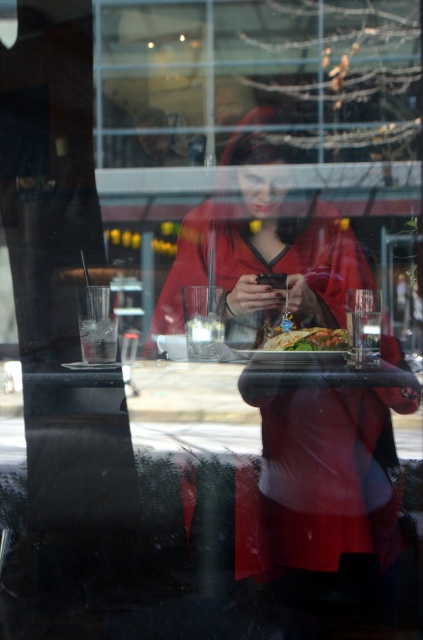
You are a delivery person standing outside the window. You want to hand over a package to the person wearing the matte red coat at center. Can you reach them through the window?

The matte red coat at center is 23.45 inches away from the viewer. Since the typical window pane allows reaching up to 24 inches, you can just barely reach the person wearing the matte red coat at center through the window.

In the scene shown: You are a painter standing in front of the transparent glass window at upper center and the green leafy salad at center. You want to paint the object that is taller. Which one should you choose?

The transparent glass window at upper center is much taller than the green leafy salad at center, so you should choose the transparent glass window at upper center to paint.

You are holding a camera and want to take a photo of the transparent glass window at upper center. The camera requires a minimum distance of 20 inches to focus properly. Can you take the photo without moving the camera?

The transparent glass window at upper center and camera are 22.34 inches apart from each other, which is more than the required 20 inches. Therefore, you can take the photo without moving the camera.